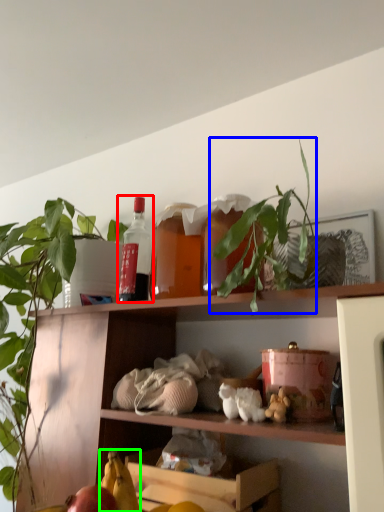
Question: Estimate the real-world distances between objects in this image. Which object is closer to bottle (highlighted by a red box), plant (highlighted by a blue box) or banana (highlighted by a green box)?

Choices:
 (A) plant
 (B) banana

Answer: (A)